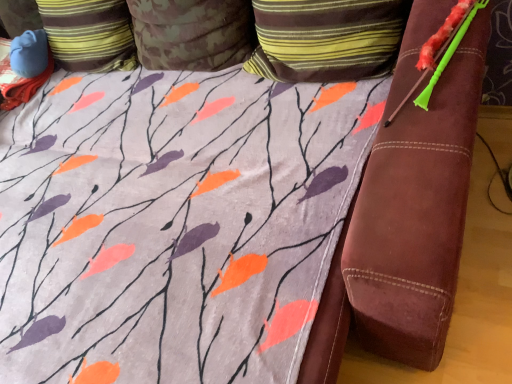
Question: Does striped fabric pillow at upper center, arranged as the 1th pillow when viewed from the right, have a lesser width compared to camouflage fabric pillow at upper left, the third pillow in the right-to-left sequence?

Choices:
 (A) no
 (B) yes

Answer: (B)

Question: From the image's perspective, is striped fabric pillow at upper center, which appears as the third pillow when viewed from the left, on top of camouflage fabric pillow at upper left, the third pillow in the right-to-left sequence?

Choices:
 (A) no
 (B) yes

Answer: (A)

Question: Is striped fabric pillow at upper center, which appears as the third pillow when viewed from the left, wider than camouflage fabric pillow at upper left, the third pillow in the right-to-left sequence?

Choices:
 (A) no
 (B) yes

Answer: (A)

Question: Does striped fabric pillow at upper center, which appears as the third pillow when viewed from the left, come in front of camouflage fabric pillow at upper left, arranged as the 1th pillow when viewed from the left?

Choices:
 (A) yes
 (B) no

Answer: (A)

Question: From the image's perspective, would you say striped fabric pillow at upper center, arranged as the 1th pillow when viewed from the right, is shown under camouflage fabric pillow at upper left, arranged as the 1th pillow when viewed from the left?

Choices:
 (A) yes
 (B) no

Answer: (A)

Question: Is striped fabric pillow at upper center, arranged as the 1th pillow when viewed from the right, touching camouflage fabric pillow at upper left, the third pillow in the right-to-left sequence?

Choices:
 (A) yes
 (B) no

Answer: (B)

Question: Is camouflage fabric pillow at upper center, which is counted as the second pillow, starting from the right, to the left of camouflage fabric pillow at upper left, the third pillow in the right-to-left sequence, from the viewer's perspective?

Choices:
 (A) no
 (B) yes

Answer: (A)

Question: Is camouflage fabric pillow at upper center, arranged as the 2th pillow when viewed from the left, beside camouflage fabric pillow at upper left, arranged as the 1th pillow when viewed from the left?

Choices:
 (A) no
 (B) yes

Answer: (A)

Question: Does camouflage fabric pillow at upper center, which is counted as the second pillow, starting from the right, have a greater width compared to camouflage fabric pillow at upper left, the third pillow in the right-to-left sequence?

Choices:
 (A) yes
 (B) no

Answer: (B)

Question: From the image's perspective, is camouflage fabric pillow at upper center, which is counted as the second pillow, starting from the right, on top of camouflage fabric pillow at upper left, arranged as the 1th pillow when viewed from the left?

Choices:
 (A) yes
 (B) no

Answer: (B)

Question: Is camouflage fabric pillow at upper center, which is counted as the second pillow, starting from the right, aimed at camouflage fabric pillow at upper left, arranged as the 1th pillow when viewed from the left?

Choices:
 (A) yes
 (B) no

Answer: (B)

Question: Is camouflage fabric pillow at upper center, which is counted as the second pillow, starting from the right, thinner than camouflage fabric pillow at upper left, arranged as the 1th pillow when viewed from the left?

Choices:
 (A) yes
 (B) no

Answer: (A)

Question: Can you confirm if striped fabric pillow at upper center, arranged as the 1th pillow when viewed from the right, is thinner than camouflage fabric pillow at upper center, which is counted as the second pillow, starting from the right?

Choices:
 (A) yes
 (B) no

Answer: (A)